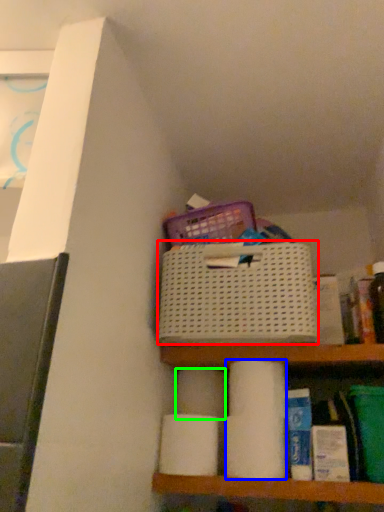
Question: Which object is positioned closest to basket (highlighted by a red box)? Select from toilet paper (highlighted by a blue box) and toilet paper (highlighted by a green box).

Choices:
 (A) toilet paper
 (B) toilet paper

Answer: (A)